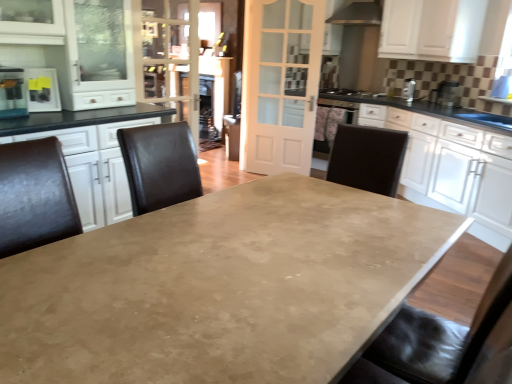
Question: Is clear glass door at upper center with black matte gas stove at upper right?

Choices:
 (A) no
 (B) yes

Answer: (A)

Question: Considering the relative sizes of clear glass door at upper center and black matte gas stove at upper right in the image provided, is clear glass door at upper center taller than black matte gas stove at upper right?

Choices:
 (A) no
 (B) yes

Answer: (B)

Question: Could black matte gas stove at upper right be considered to be inside clear glass door at upper center?

Choices:
 (A) no
 (B) yes

Answer: (A)

Question: Considering the relative sizes of clear glass door at upper center and black matte gas stove at upper right in the image provided, is clear glass door at upper center bigger than black matte gas stove at upper right?

Choices:
 (A) yes
 (B) no

Answer: (A)

Question: From a real-world perspective, is clear glass door at upper center positioned over black matte gas stove at upper right based on gravity?

Choices:
 (A) no
 (B) yes

Answer: (B)

Question: Is clear glass door at upper center oriented away from black matte gas stove at upper right?

Choices:
 (A) no
 (B) yes

Answer: (A)

Question: Would you say black matte gas stove at upper right is a long distance from white glossy cabinet at right, which appears as the 1th cabinetry when ordered from the bottom?

Choices:
 (A) no
 (B) yes

Answer: (B)

Question: Can you confirm if black matte gas stove at upper right is positioned to the right of white glossy cabinet at right, marked as the second cabinetry in a top-to-bottom arrangement?

Choices:
 (A) no
 (B) yes

Answer: (A)

Question: Does black matte gas stove at upper right touch white glossy cabinet at right, which appears as the 1th cabinetry when ordered from the bottom?

Choices:
 (A) yes
 (B) no

Answer: (B)

Question: Considering the relative sizes of black matte gas stove at upper right and white glossy cabinet at right, marked as the second cabinetry in a top-to-bottom arrangement, in the image provided, is black matte gas stove at upper right shorter than white glossy cabinet at right, marked as the second cabinetry in a top-to-bottom arrangement,?

Choices:
 (A) no
 (B) yes

Answer: (B)

Question: Is black matte gas stove at upper right to the left of white glossy cabinet at right, marked as the second cabinetry in a top-to-bottom arrangement, from the viewer's perspective?

Choices:
 (A) no
 (B) yes

Answer: (B)

Question: From a real-world perspective, is black matte gas stove at upper right on white glossy cabinet at right, marked as the second cabinetry in a top-to-bottom arrangement?

Choices:
 (A) no
 (B) yes

Answer: (B)

Question: Is black matte gas stove at upper right oriented towards clear glass door at upper center?

Choices:
 (A) yes
 (B) no

Answer: (A)